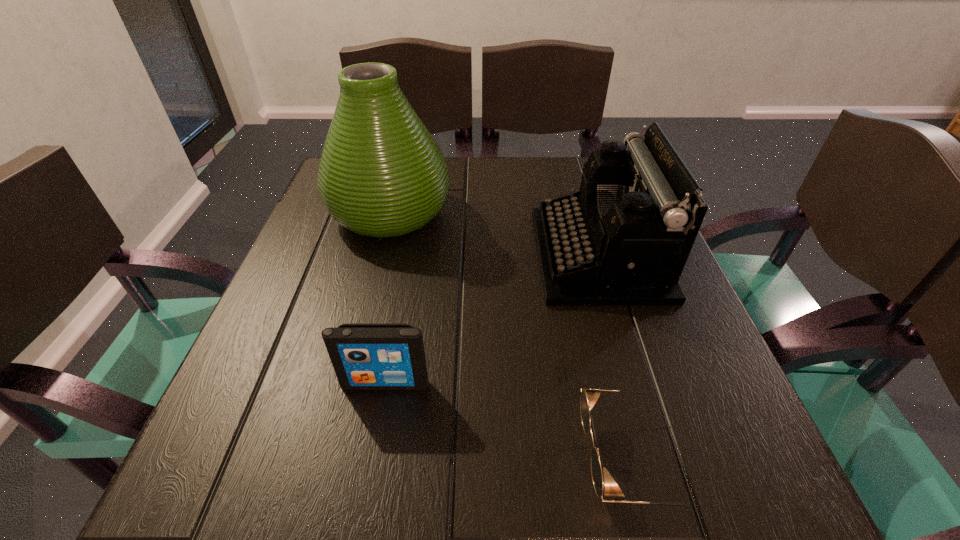
This screenshot has height=540, width=960. Find the location of `object at the far left corner`. object at the far left corner is located at coordinates (381, 174).

Image resolution: width=960 pixels, height=540 pixels. In order to click on object present at the near right corner in this screenshot , I will do `click(589, 397)`.

In the image, there is a desktop. In order to click on blank space at the far edge in this screenshot , I will do `click(482, 194)`.

In order to click on blank area at the near edge in this screenshot , I will do `click(446, 516)`.

Identify the location of vacant space at the left edge. This screenshot has width=960, height=540. (309, 389).

Find the location of `vacant position at the right edge of the desktop`. vacant position at the right edge of the desktop is located at coordinates (648, 423).

You are a GUI agent. You are given a task and a screenshot of the screen. Output one action in this format:
    pyautogui.click(x=<x>, y=<y>)
    Task: Click on the vacant space at the near right corner of the desktop
    
    Given the screenshot: What is the action you would take?
    pyautogui.click(x=765, y=490)

Where is `vacant space that is in between the tallest object and the second nearest object`? This screenshot has height=540, width=960. vacant space that is in between the tallest object and the second nearest object is located at coordinates (388, 298).

The width and height of the screenshot is (960, 540). Identify the location of empty location between the second nearest object and the sunglasses. (509, 420).

Where is `blank region between the vase and the typewriter`? This screenshot has height=540, width=960. blank region between the vase and the typewriter is located at coordinates (494, 234).